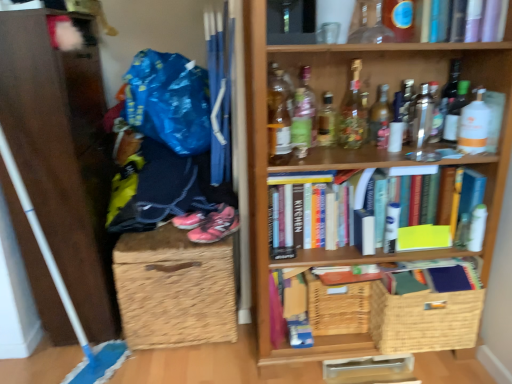
Question: From the image's perspective, would you say brown wicker basket at lower left is positioned over translucent glass bottle at center, which is the fourth bottle from left to right?

Choices:
 (A) yes
 (B) no

Answer: (B)

Question: Does brown wicker basket at lower left have a larger size compared to translucent glass bottle at center, which is the fourth bottle from left to right?

Choices:
 (A) no
 (B) yes

Answer: (B)

Question: Is translucent glass bottle at center, the eighth bottle positioned from the right, inside brown wicker basket at lower left?

Choices:
 (A) yes
 (B) no

Answer: (B)

Question: Are brown wicker basket at lower left and translucent glass bottle at center, which is the fourth bottle from left to right, far apart?

Choices:
 (A) no
 (B) yes

Answer: (A)

Question: From the image's perspective, is brown wicker basket at lower left below translucent glass bottle at center, the eighth bottle positioned from the right?

Choices:
 (A) yes
 (B) no

Answer: (A)

Question: In terms of height, does green glass bottle at upper center, the second bottle from the left, look taller or shorter compared to translucent glass bottle at upper center, marked as the eleventh bottle in a right-to-left arrangement?

Choices:
 (A) short
 (B) tall

Answer: (A)

Question: Looking at their shapes, would you say green glass bottle at upper center, the 10th bottle from the right, is wider or thinner than translucent glass bottle at upper center, the first bottle from the left?

Choices:
 (A) wide
 (B) thin

Answer: (A)

Question: Would you say green glass bottle at upper center, the second bottle from the left, is inside or outside translucent glass bottle at upper center, marked as the eleventh bottle in a right-to-left arrangement?

Choices:
 (A) outside
 (B) inside

Answer: (A)

Question: In terms of size, does green glass bottle at upper center, the second bottle from the left, appear bigger or smaller than translucent glass bottle at upper center, the first bottle from the left?

Choices:
 (A) big
 (B) small

Answer: (B)

Question: From the image's perspective, is translucent glass bottle at upper center, marked as the eleventh bottle in a right-to-left arrangement, above or below translucent glass bottle at upper right, acting as the fifth bottle starting from the right?

Choices:
 (A) below
 (B) above

Answer: (A)

Question: Looking at their shapes, would you say translucent glass bottle at upper center, marked as the eleventh bottle in a right-to-left arrangement, is wider or thinner than translucent glass bottle at upper right, arranged as the seventh bottle when viewed from the left?

Choices:
 (A) wide
 (B) thin

Answer: (B)

Question: In terms of height, does translucent glass bottle at upper center, marked as the eleventh bottle in a right-to-left arrangement, look taller or shorter compared to translucent glass bottle at upper right, arranged as the seventh bottle when viewed from the left?

Choices:
 (A) tall
 (B) short

Answer: (A)

Question: Considering the relative positions of translucent glass bottle at upper center, marked as the eleventh bottle in a right-to-left arrangement, and translucent glass bottle at upper right, arranged as the seventh bottle when viewed from the left, in the image provided, is translucent glass bottle at upper center, marked as the eleventh bottle in a right-to-left arrangement, to the left or to the right of translucent glass bottle at upper right, arranged as the seventh bottle when viewed from the left,?

Choices:
 (A) left
 (B) right

Answer: (A)

Question: From the image's perspective, is translucent glass bottle at upper center, placed as the eighth bottle when sorted from left to right, above or below woven brown basket at lower right, the first basket from the right?

Choices:
 (A) below
 (B) above

Answer: (B)

Question: Considering their positions, is translucent glass bottle at upper center, placed as the eighth bottle when sorted from left to right, located in front of or behind woven brown basket at lower right, the second basket when ordered from left to right?

Choices:
 (A) behind
 (B) front

Answer: (A)